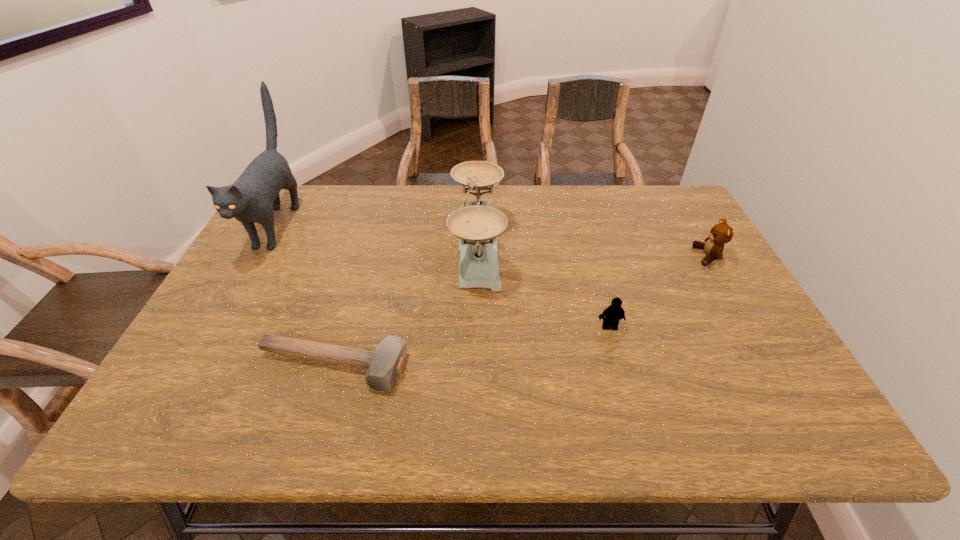
Identify the location of vacant space located 0.300m at the face of the leftmost object. This screenshot has height=540, width=960. (200, 361).

Identify the location of free spot located on the front-facing side of the third object from right to left. (528, 247).

You are a GUI agent. You are given a task and a screenshot of the screen. Output one action in this format:
    pyautogui.click(x=<x>, y=<y>)
    Task: Click on the vacant area situated 0.060m on the front-facing side of the third tallest object
    
    Given the screenshot: What is the action you would take?
    click(x=675, y=256)

This screenshot has height=540, width=960. What are the coordinates of `vacant area situated 0.230m on the front-facing side of the third tallest object` in the screenshot? It's located at (615, 256).

You are a GUI agent. You are given a task and a screenshot of the screen. Output one action in this format:
    pyautogui.click(x=<x>, y=<y>)
    Task: Click on the blank space located on the front-facing side of the third tallest object
    This screenshot has height=540, width=960.
    Given the screenshot: What is the action you would take?
    pyautogui.click(x=560, y=256)

At what (x,y) coordinates should I click in order to perform the action: click on blank space located on the face of the Lego. Please return your answer as a coordinate pair (x, y). The image size is (960, 540). Looking at the image, I should click on (633, 409).

Locate an element on the screen. The image size is (960, 540). vacant space located 0.240m on the back of the fourth object from right to left is located at coordinates (359, 274).

You are a GUI agent. You are given a task and a screenshot of the screen. Output one action in this format:
    pyautogui.click(x=<x>, y=<y>)
    Task: Click on the cat that is at the far edge
    This screenshot has width=960, height=540.
    Given the screenshot: What is the action you would take?
    [252, 198]

Locate an element on the screen. The width and height of the screenshot is (960, 540). scale that is at the far edge is located at coordinates (477, 225).

Where is `object positioned at the left edge`? This screenshot has width=960, height=540. object positioned at the left edge is located at coordinates (252, 198).